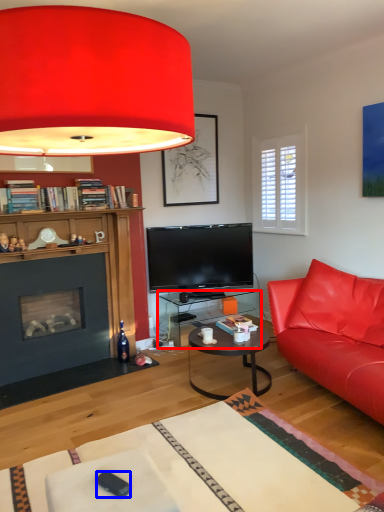
Question: Among these objects, which one is farthest to the camera, desk (highlighted by a red box) or remote control (highlighted by a blue box)?

Choices:
 (A) desk
 (B) remote control

Answer: (A)